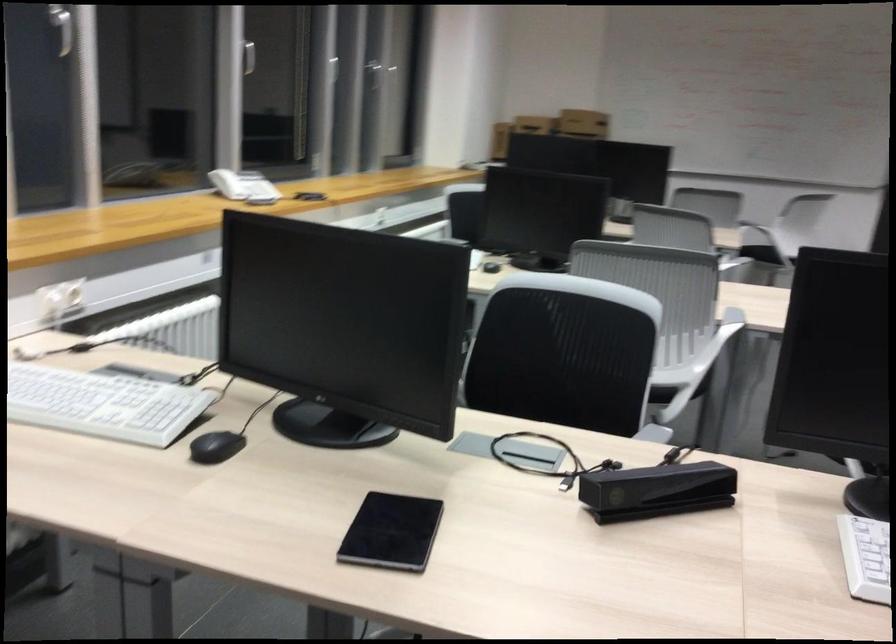
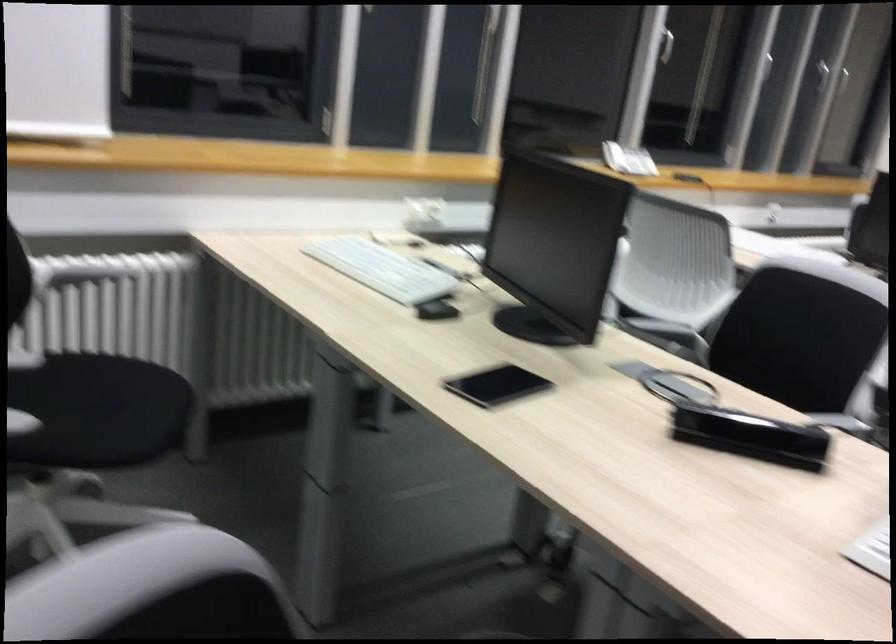
Locate, in the second image, the point that corresponds to pixel 552 357 in the first image.

(798, 337)